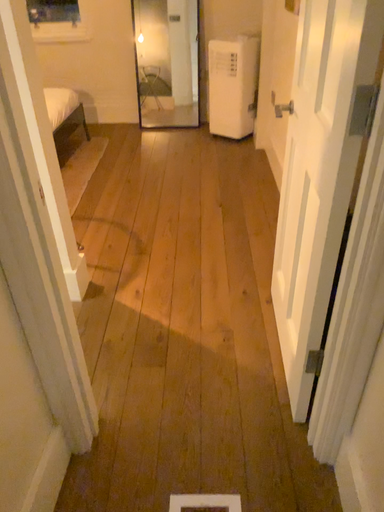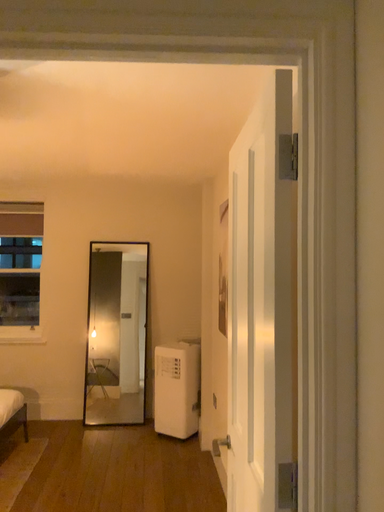
Question: How did the camera likely rotate when shooting the video?

Choices:
 (A) rotated left
 (B) rotated right

Answer: (B)